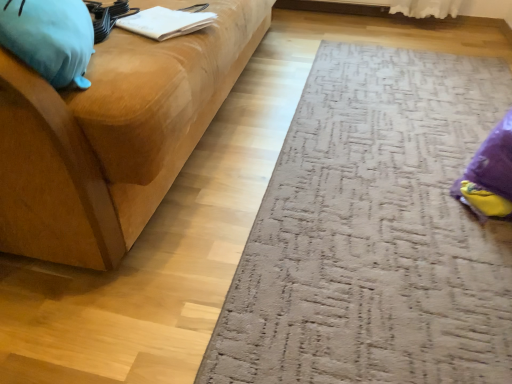
Locate an element on the screen. Image resolution: width=512 pixels, height=384 pixels. vacant space underneath textured gray doormat at lower right (from a real-world perspective) is located at coordinates (393, 142).